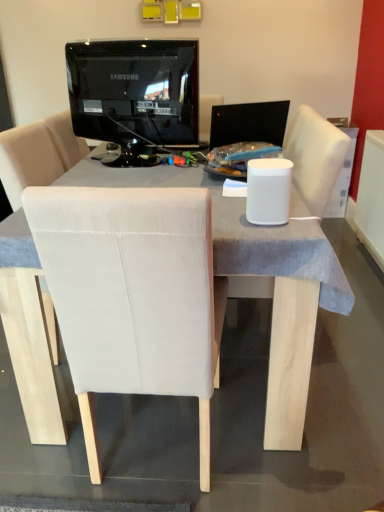
This screenshot has height=512, width=384. Describe the element at coordinates (249, 123) in the screenshot. I see `black glossy monitor at center` at that location.

Locate an element on the screen. black glossy monitor at upper center is located at coordinates (135, 92).

Is white plastic radiator at right in contact with black glossy monitor at center?

white plastic radiator at right and black glossy monitor at center are clearly separated.

Between white plastic radiator at right and black glossy monitor at center, which one is positioned behind?

white plastic radiator at right is further from the camera.

From the image's perspective, who appears lower, white plastic radiator at right or black glossy monitor at center?

white plastic radiator at right, from the image's perspective.

Is white plastic radiator at right a part of black glossy monitor at center?

Actually, white plastic radiator at right is outside black glossy monitor at center.

Looking at the image, does black glossy monitor at center seem bigger or smaller compared to white plastic radiator at right?

black glossy monitor at center is smaller than white plastic radiator at right.

From the image's perspective, does black glossy monitor at center appear higher than white plastic radiator at right?

Yes, from the image's perspective, black glossy monitor at center is over white plastic radiator at right.

Considering the sizes of objects white plastic radiator at right and black glossy monitor at upper center in the image provided, who is shorter, white plastic radiator at right or black glossy monitor at upper center?

black glossy monitor at upper center.

How many degrees apart are the facing directions of white plastic radiator at right and black glossy monitor at upper center?

They differ by 104 degrees in their facing directions.

Considering the sizes of objects white plastic radiator at right and black glossy monitor at upper center in the image provided, who is smaller, white plastic radiator at right or black glossy monitor at upper center?

white plastic radiator at right is smaller.

From the image's perspective, would you say white plastic radiator at right is positioned over black glossy monitor at upper center?

No.

Between black glossy monitor at upper center and white plastic radiator at right, which one has more height?

With more height is white plastic radiator at right.

Is black glossy monitor at upper center surrounding white plastic radiator at right?

No, white plastic radiator at right is not a part of black glossy monitor at upper center.

From a real-world perspective, is black glossy monitor at upper center above or below white plastic radiator at right?

In terms of real-world spatial position, black glossy monitor at upper center is above white plastic radiator at right.

Is black glossy monitor at upper center positioned with its back to black glossy monitor at center?

black glossy monitor at upper center does not have its back to black glossy monitor at center.

Is the position of black glossy monitor at upper center less distant than that of black glossy monitor at center?

That is True.

Between black glossy monitor at upper center and black glossy monitor at center, which one has smaller width?

black glossy monitor at upper center is thinner.

Considering the relative positions of black glossy monitor at upper center and black glossy monitor at center in the image provided, is black glossy monitor at upper center to the left of black glossy monitor at center from the viewer's perspective?

Yes.

Does point (211, 131) appear closer or farther from the camera than point (152, 104)?

Clearly, point (211, 131) is more distant from the camera than point (152, 104).

Could black glossy monitor at upper center be considered to be inside black glossy monitor at center?

No, black glossy monitor at center does not contain black glossy monitor at upper center.

Does black glossy monitor at center have a larger size compared to black glossy monitor at upper center?

Incorrect, black glossy monitor at center is not larger than black glossy monitor at upper center.

Is black glossy monitor at center oriented towards black glossy monitor at upper center?

No, black glossy monitor at center does not turn towards black glossy monitor at upper center.

The height and width of the screenshot is (512, 384). I want to click on radiator that is below the black glossy monitor at center (from the image's perspective), so click(x=372, y=197).

Identify the location of computer monitor above the white plastic radiator at right (from a real-world perspective). This screenshot has width=384, height=512. (249, 123).

Considering their positions, is white plastic radiator at right positioned closer to black glossy monitor at center than black glossy monitor at upper center?

Among the two, black glossy monitor at upper center is located nearer to black glossy monitor at center.

Which object lies further to the anchor point white plastic radiator at right, black glossy monitor at center or black glossy monitor at upper center?

Among the two, black glossy monitor at upper center is located further to white plastic radiator at right.

Estimate the real-world distances between objects in this image. Which object is further from black glossy monitor at center, black glossy monitor at upper center or white plastic radiator at right?

white plastic radiator at right is positioned further to the anchor black glossy monitor at center.

Looking at the image, which one is located further to black glossy monitor at upper center, white plastic radiator at right or black glossy monitor at center?

white plastic radiator at right is positioned further to the anchor black glossy monitor at upper center.

Looking at the image, which one is located closer to black glossy monitor at upper center, black glossy monitor at center or white plastic radiator at right?

black glossy monitor at center is closer to black glossy monitor at upper center.

Based on their spatial positions, is black glossy monitor at upper center or black glossy monitor at center further from white plastic radiator at right?

black glossy monitor at upper center is positioned further to the anchor white plastic radiator at right.

This screenshot has width=384, height=512. I want to click on computer monitor between black glossy monitor at upper center and white plastic radiator at right from left to right, so click(x=249, y=123).